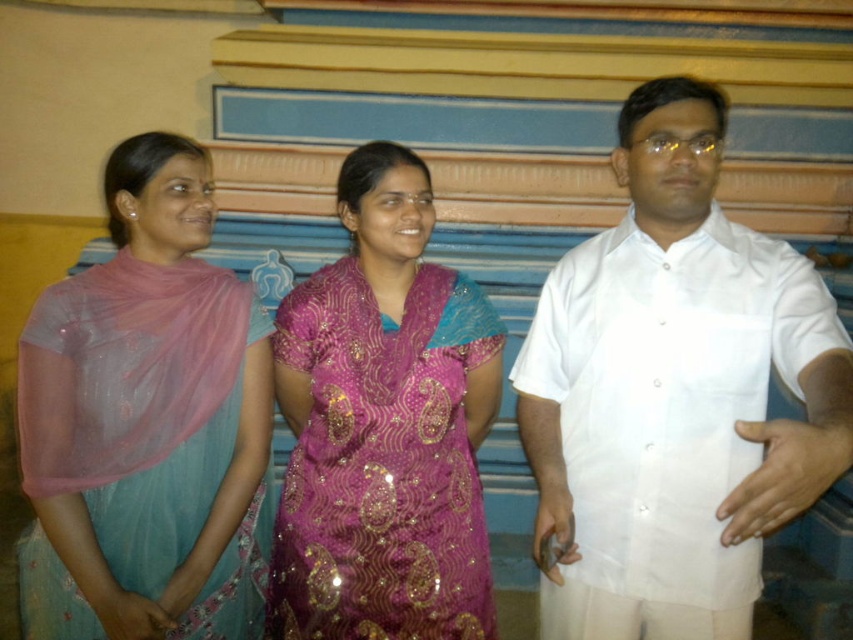
Question: Which point is farther to the camera?

Choices:
 (A) [x=622, y=499]
 (B) [x=119, y=536]

Answer: (B)

Question: Observing the image, what is the correct spatial positioning of white linen shirt at right in reference to purple sequined dress at center?

Choices:
 (A) below
 (B) above

Answer: (B)

Question: Which of the following is the closest to the observer?

Choices:
 (A) (633, 124)
 (B) (24, 468)
 (C) (321, 413)

Answer: (B)

Question: Is white linen shirt at right positioned before light blue silk saree at left?

Choices:
 (A) yes
 (B) no

Answer: (A)

Question: Can you confirm if white linen shirt at right is smaller than light blue silk saree at left?

Choices:
 (A) yes
 (B) no

Answer: (B)

Question: Which point appears farthest from the camera in this image?

Choices:
 (A) (186, 381)
 (B) (416, 224)
 (C) (746, 634)

Answer: (B)